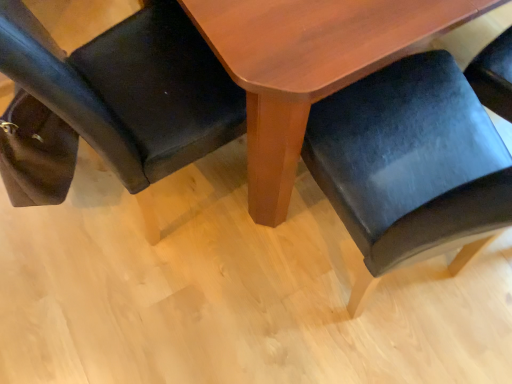
Locate an element on the screen. The height and width of the screenshot is (384, 512). space that is in front of matte black chair at lower left, marked as the 2th chair in a right-to-left arrangement is located at coordinates click(168, 305).